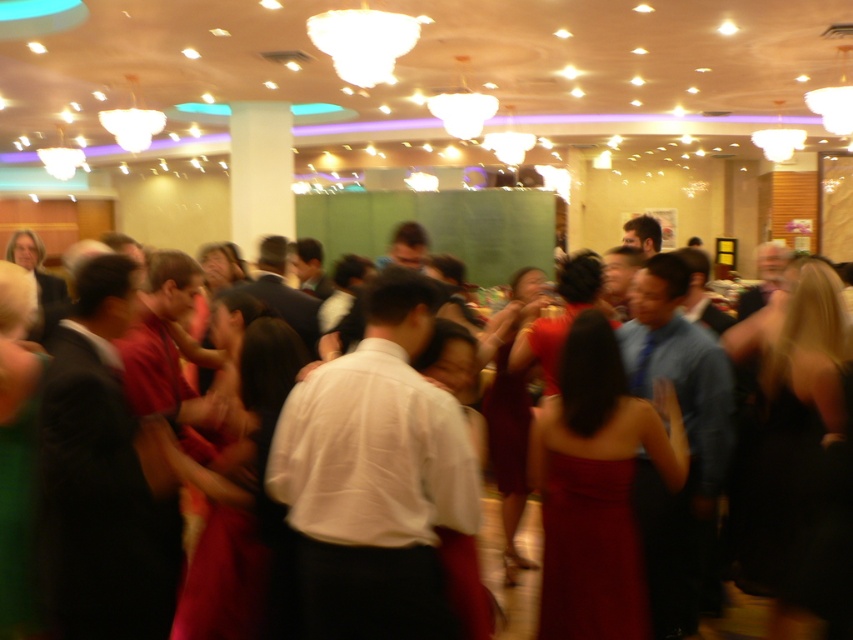
Who is positioned more to the left, matte red dress at center or matte white dress at center?

matte red dress at center

Is point (601, 486) in front of point (189, 531)?

Yes, it is.

Between point (541, 513) and point (527, 513), which one is positioned in front?

Point (541, 513) is in front.

Find the location of `matte red dress at center`. matte red dress at center is located at coordinates (590, 552).

Does matte red dress at center have a lesser height compared to velvet burgundy dress at center?

Yes, matte red dress at center is shorter than velvet burgundy dress at center.

The width and height of the screenshot is (853, 640). Describe the element at coordinates (590, 552) in the screenshot. I see `matte red dress at center` at that location.

Locate an element on the screen. Image resolution: width=853 pixels, height=640 pixels. matte red dress at center is located at coordinates (590, 552).

Can you confirm if matte white dress at center is smaller than velvet burgundy dress at center?

Yes.

Measure the distance between point (491,564) and camera.

Point (491,564) is 4.17 meters from camera.

Where is `matte white dress at center`? The height and width of the screenshot is (640, 853). matte white dress at center is located at coordinates (503, 576).